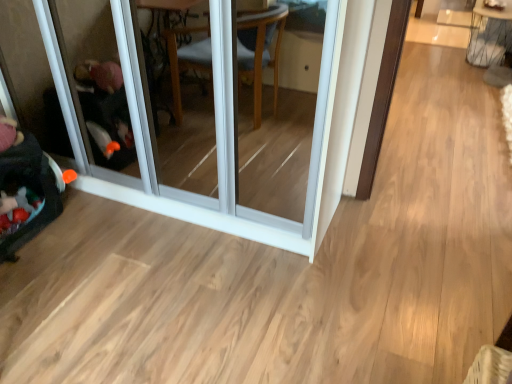
Where is `velvet black baby carriage at left`? velvet black baby carriage at left is located at coordinates (26, 188).

The image size is (512, 384). What do you see at coordinates (26, 188) in the screenshot?
I see `velvet black baby carriage at left` at bounding box center [26, 188].

In order to face transparent glass screen door at left, should I rotate leftwards or rightwards?

Turn left by 10.920 degrees to look at transparent glass screen door at left.

The height and width of the screenshot is (384, 512). Identify the location of metallic wire table at upper right. (489, 35).

Between point (230, 81) and point (30, 176), which one is positioned in front?

The point (230, 81) is in front.

From the image's perspective, is transparent glass screen door at left located above or below velvet black baby carriage at left?

transparent glass screen door at left is above velvet black baby carriage at left.

Considering the positions of objects transparent glass screen door at left and velvet black baby carriage at left in the image provided, who is more to the right, transparent glass screen door at left or velvet black baby carriage at left?

From the viewer's perspective, transparent glass screen door at left appears more on the right side.

Would you say transparent glass screen door at left contains velvet black baby carriage at left?

No, velvet black baby carriage at left is located outside of transparent glass screen door at left.

Is metallic wire table at upper right to the right of transparent glass screen door at left from the viewer's perspective?

Indeed, metallic wire table at upper right is positioned on the right side of transparent glass screen door at left.

Considering the sizes of objects metallic wire table at upper right and transparent glass screen door at left in the image provided, who is bigger, metallic wire table at upper right or transparent glass screen door at left?

With larger size is transparent glass screen door at left.

Is metallic wire table at upper right not near transparent glass screen door at left?

Yes, metallic wire table at upper right is far from transparent glass screen door at left.

Between metallic wire table at upper right and transparent glass screen door at left, which one is positioned behind?

metallic wire table at upper right.

Which is behind, point (87, 163) or point (497, 19)?

The point (497, 19) is farther.

In terms of width, does transparent glass screen door at left look wider or thinner when compared to metallic wire table at upper right?

transparent glass screen door at left is wider than metallic wire table at upper right.

Is transparent glass screen door at left in front of metallic wire table at upper right?

Yes, transparent glass screen door at left is closer to the viewer.

Does transparent glass screen door at left appear on the right side of metallic wire table at upper right?

No.

Consider the image. From the image's perspective, which is above, metallic wire table at upper right or velvet black baby carriage at left?

metallic wire table at upper right.

From a real-world perspective, relative to velvet black baby carriage at left, is metallic wire table at upper right vertically above or below?

metallic wire table at upper right is situated higher than velvet black baby carriage at left in the real world.

Which is more distant, (x=495, y=31) or (x=3, y=120)?

Point (x=495, y=31)

Is metallic wire table at upper right taller than velvet black baby carriage at left?

Correct, metallic wire table at upper right is much taller as velvet black baby carriage at left.

Is velvet black baby carriage at left oriented away from metallic wire table at upper right?

No, velvet black baby carriage at left is not facing away from metallic wire table at upper right.

From a real-world perspective, which is physically below, velvet black baby carriage at left or metallic wire table at upper right?

In real-world perspective, velvet black baby carriage at left is lower.

Is metallic wire table at upper right surrounded by velvet black baby carriage at left?

No, metallic wire table at upper right is not inside velvet black baby carriage at left.

Considering the sizes of objects velvet black baby carriage at left and metallic wire table at upper right in the image provided, who is wider, velvet black baby carriage at left or metallic wire table at upper right?

A: metallic wire table at upper right.

Who is shorter, velvet black baby carriage at left or transparent glass screen door at left?

velvet black baby carriage at left.

Are velvet black baby carriage at left and transparent glass screen door at left beside each other?

velvet black baby carriage at left is not next to transparent glass screen door at left, and they're not touching.

Looking at this image, which object is wider, velvet black baby carriage at left or transparent glass screen door at left?

transparent glass screen door at left.

From a real-world perspective, which is physically below, velvet black baby carriage at left or transparent glass screen door at left?

velvet black baby carriage at left is physically lower.

Find the location of a particular element. baby carriage on the left of transparent glass screen door at left is located at coordinates (26, 188).

The height and width of the screenshot is (384, 512). In order to click on screen door lying below the metallic wire table at upper right (from the image's perspective) in this screenshot , I will do `click(213, 128)`.

Looking at the image, which one is located further to metallic wire table at upper right, transparent glass screen door at left or velvet black baby carriage at left?

velvet black baby carriage at left is positioned further to the anchor metallic wire table at upper right.

Looking at this image, when comparing their distances from transparent glass screen door at left, does metallic wire table at upper right or velvet black baby carriage at left seem closer?

velvet black baby carriage at left lies closer to transparent glass screen door at left than the other object.

From the image, which object appears to be farther from transparent glass screen door at left, velvet black baby carriage at left or metallic wire table at upper right?

The object further to transparent glass screen door at left is metallic wire table at upper right.

Which object lies nearer to the anchor point velvet black baby carriage at left, metallic wire table at upper right or transparent glass screen door at left?

transparent glass screen door at left is positioned closer to the anchor velvet black baby carriage at left.

From the image, which object appears to be farther from velvet black baby carriage at left, transparent glass screen door at left or metallic wire table at upper right?

metallic wire table at upper right is positioned further to the anchor velvet black baby carriage at left.

Consider the image. Estimate the real-world distances between objects in this image. Which object is closer to metallic wire table at upper right, velvet black baby carriage at left or transparent glass screen door at left?

The object closer to metallic wire table at upper right is transparent glass screen door at left.

Locate an element on the screen. Image resolution: width=512 pixels, height=384 pixels. screen door located between velvet black baby carriage at left and metallic wire table at upper right in the left-right direction is located at coordinates (213, 128).